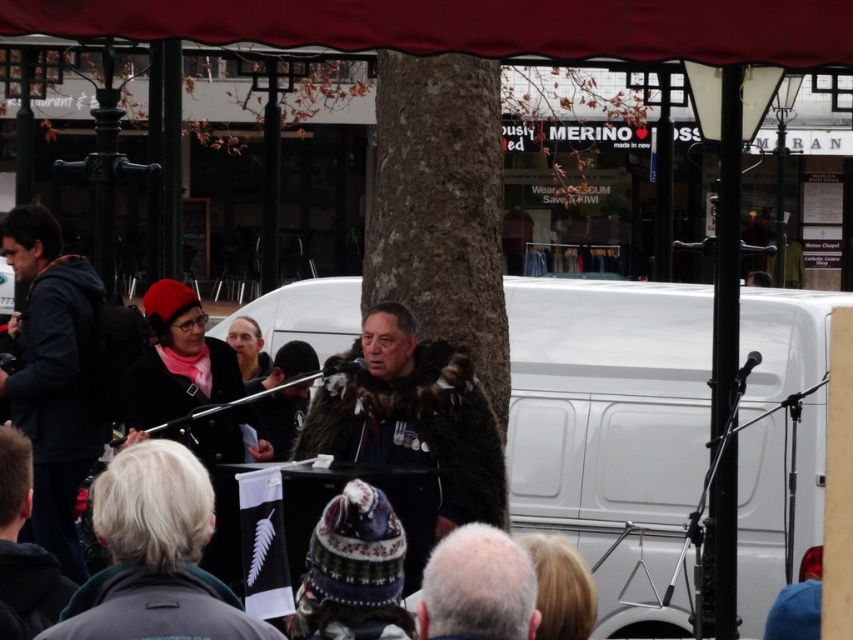
Question: Is brown rough bark at center positioned behind fur coat at center?

Choices:
 (A) yes
 (B) no

Answer: (A)

Question: In this image, where is white matte van at center located relative to dark blue hoodie at left?

Choices:
 (A) left
 (B) right

Answer: (B)

Question: Which point appears closest to the camera in this image?

Choices:
 (A) (492, 522)
 (B) (526, 486)

Answer: (A)

Question: Which point is closer to the camera taking this photo?

Choices:
 (A) (518, 563)
 (B) (26, 316)
 (C) (749, 524)
 (D) (399, 106)

Answer: (A)

Question: Considering the real-world distances, which object is farthest from the fur coat at center?

Choices:
 (A) brown rough bark at center
 (B) white matte van at center
 (C) gray woolen hat at lower center

Answer: (C)

Question: Does fur coat at center appear on the right side of gray woolen hat at lower center?

Choices:
 (A) yes
 (B) no

Answer: (B)